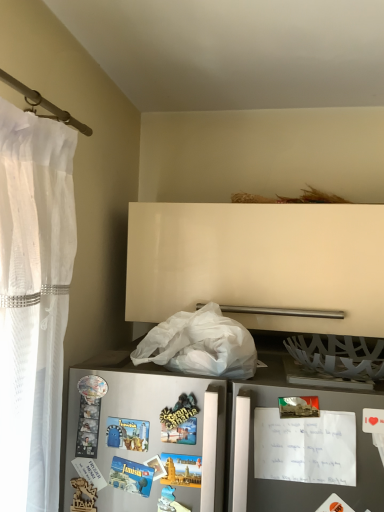
Question: Does metallic postcard at right have a greater height compared to white matte plastic bag at lower center?

Choices:
 (A) no
 (B) yes

Answer: (B)

Question: Does metallic postcard at right appear on the left side of white matte plastic bag at lower center?

Choices:
 (A) no
 (B) yes

Answer: (A)

Question: Is metallic postcard at right facing towards white matte plastic bag at lower center?

Choices:
 (A) no
 (B) yes

Answer: (A)

Question: Is metallic postcard at right placed right next to white matte plastic bag at lower center?

Choices:
 (A) yes
 (B) no

Answer: (B)

Question: Does metallic postcard at right have a greater width compared to white matte plastic bag at lower center?

Choices:
 (A) yes
 (B) no

Answer: (B)

Question: Does point (218, 316) appear closer or farther from the camera than point (322, 443)?

Choices:
 (A) farther
 (B) closer

Answer: (A)

Question: From the image's perspective, is white matte plastic bag at lower center positioned above or below metallic postcard at right?

Choices:
 (A) below
 (B) above

Answer: (B)

Question: Do you think white matte plastic bag at lower center is within metallic postcard at right, or outside of it?

Choices:
 (A) inside
 (B) outside

Answer: (B)

Question: Is white matte plastic bag at lower center taller or shorter than metallic postcard at right?

Choices:
 (A) short
 (B) tall

Answer: (A)

Question: Would you say metallic gray refrigerator at lower left is inside or outside metallic postcard at right?

Choices:
 (A) inside
 (B) outside

Answer: (B)

Question: From a real-world perspective, is metallic gray refrigerator at lower left above or below metallic postcard at right?

Choices:
 (A) below
 (B) above

Answer: (A)

Question: Looking at the image, does metallic gray refrigerator at lower left seem bigger or smaller compared to metallic postcard at right?

Choices:
 (A) big
 (B) small

Answer: (A)

Question: Looking at their shapes, would you say metallic gray refrigerator at lower left is wider or thinner than metallic postcard at right?

Choices:
 (A) thin
 (B) wide

Answer: (A)

Question: From a real-world perspective, is metallic gray refrigerator at lower left above or below white matte plastic bag at lower center?

Choices:
 (A) below
 (B) above

Answer: (A)

Question: Is metallic gray refrigerator at lower left situated inside white matte plastic bag at lower center or outside?

Choices:
 (A) outside
 (B) inside

Answer: (A)